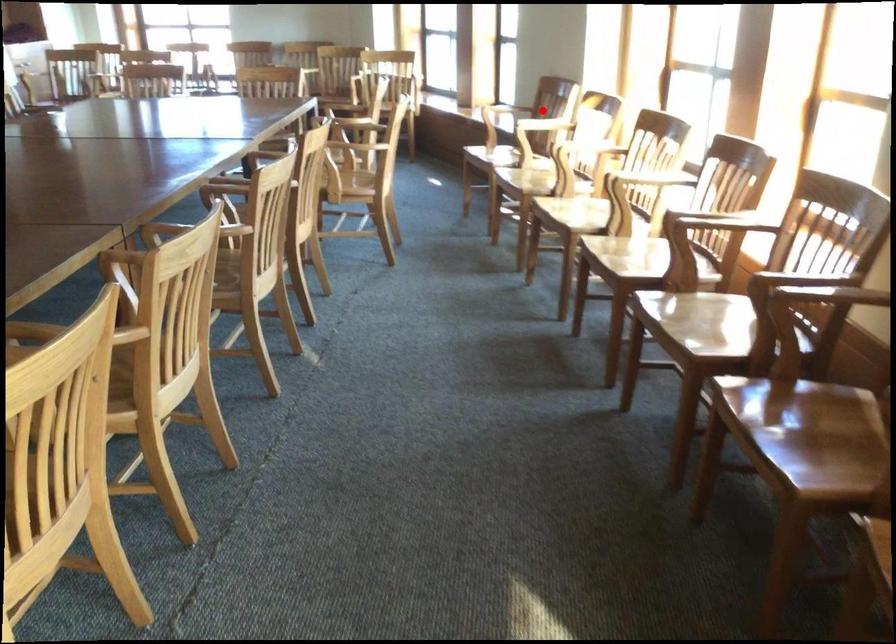
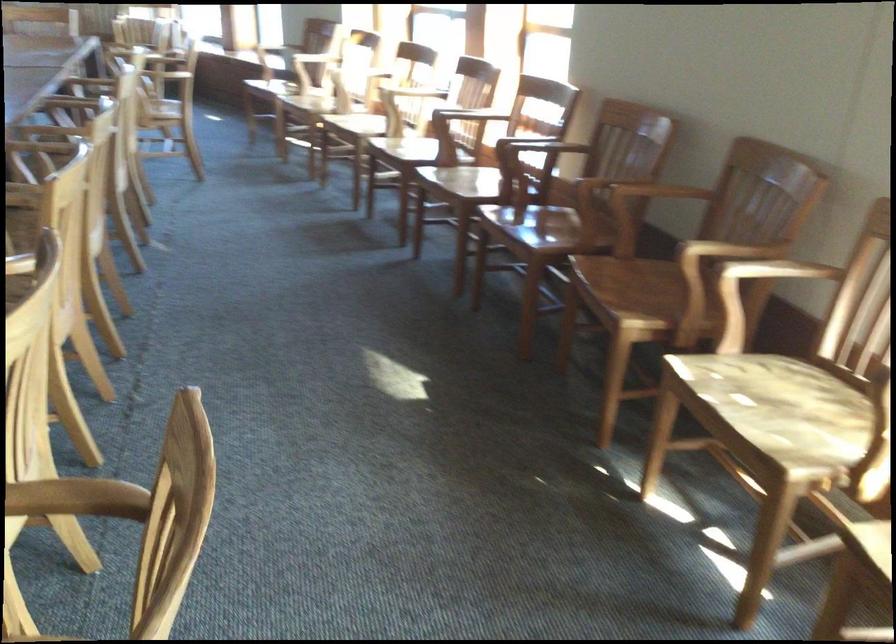
Question: I am providing you with two images of the same scene from different viewpoints. Image1 has a red point marked. In image2, the corresponding 3D location appears at what relative position? Reply with the corresponding letter.

Choices:
 (A) Closer
 (B) Farther

Answer: (B)